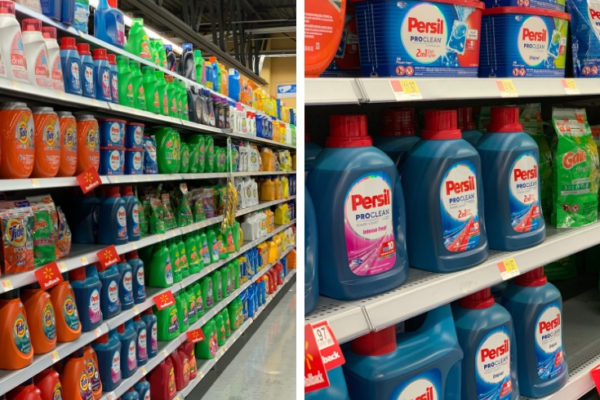
I want to click on yellow laundary detergent bottles, so click(x=282, y=187), click(x=268, y=187), click(x=271, y=247), click(x=278, y=102).